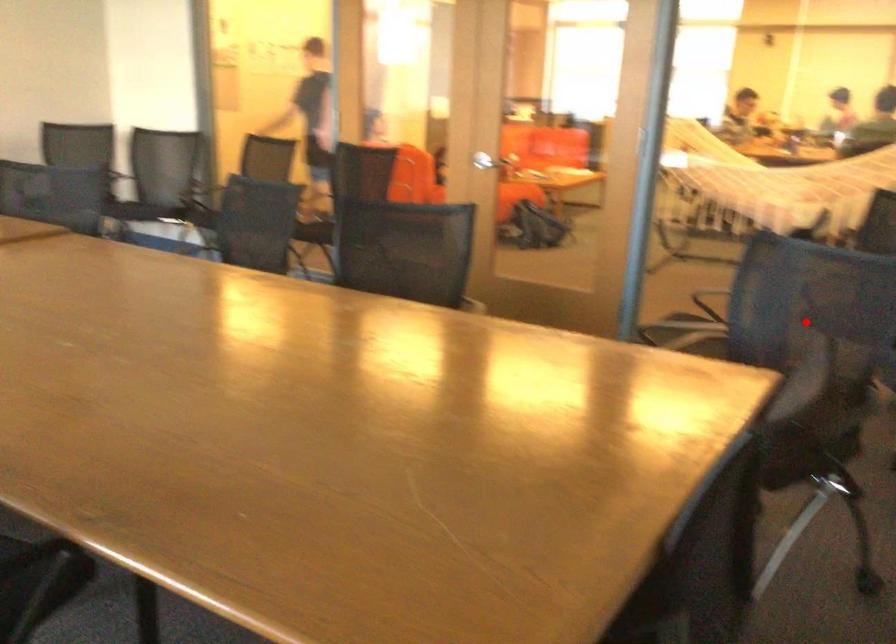
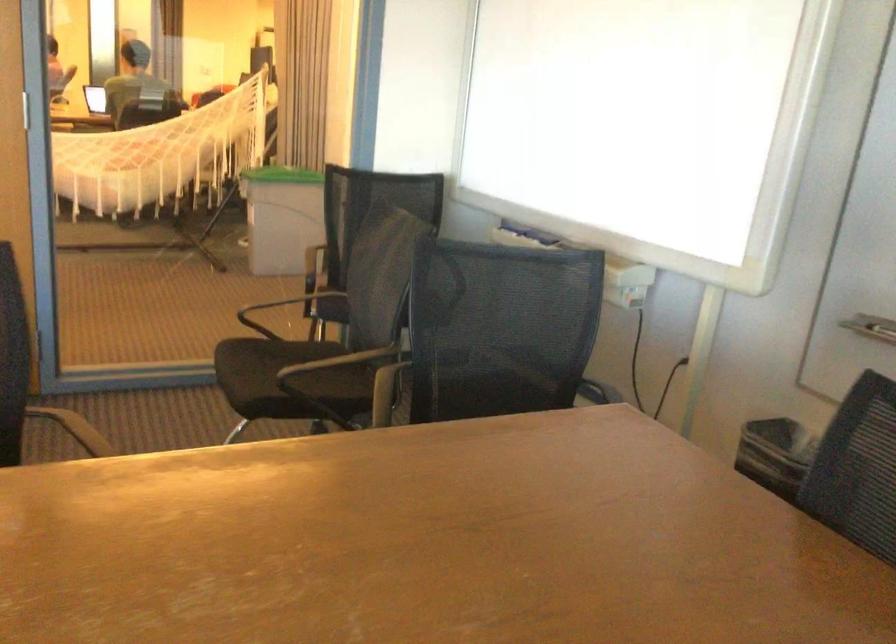
Locate, in the second image, the point that corresponds to the highlighted location in the first image.

(501, 328)